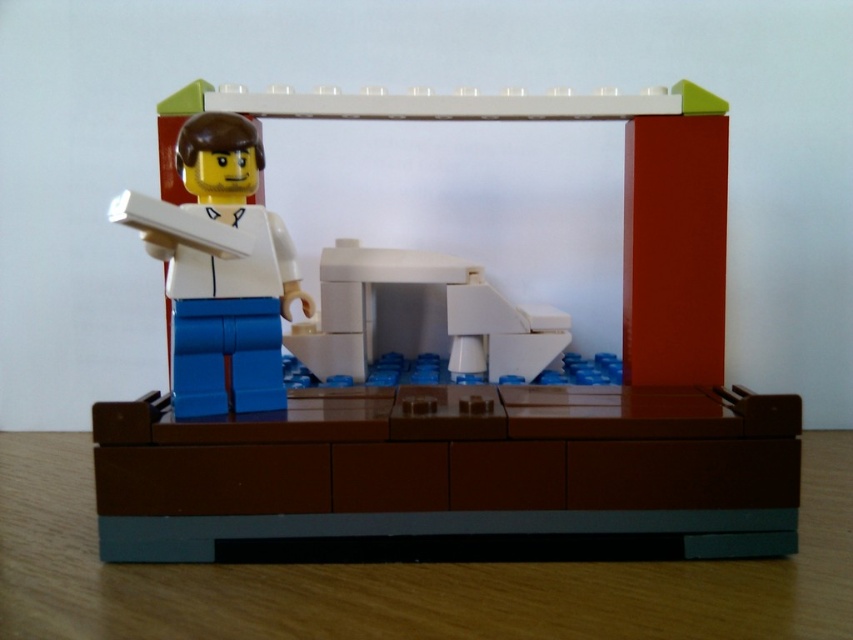
Is point (448, 300) positioned after point (184, 291)?

Yes, point (448, 300) is farther from viewer.

In order to click on white plastic minifigure at center in this screenshot , I will do pos(451,369).

Does point (392, 113) lie in front of point (207, 140)?

That is False.

Locate an element on the screen. white plastic minifigure at center is located at coordinates (451, 369).

Does point (231, 342) come behind point (474, 301)?

No, it is in front of (474, 301).

Does white matte minifigure at center appear on the left side of white plastic microwave at center?

Correct, you'll find white matte minifigure at center to the left of white plastic microwave at center.

The width and height of the screenshot is (853, 640). What do you see at coordinates (225, 276) in the screenshot? I see `white matte minifigure at center` at bounding box center [225, 276].

Image resolution: width=853 pixels, height=640 pixels. I want to click on white matte minifigure at center, so click(x=225, y=276).

From the picture: Does white plastic minifigure at center appear over white plastic microwave at center?

Yes.

Locate an element on the screen. This screenshot has height=640, width=853. white plastic minifigure at center is located at coordinates (451, 369).

Locate an element on the screen. white plastic minifigure at center is located at coordinates (451, 369).